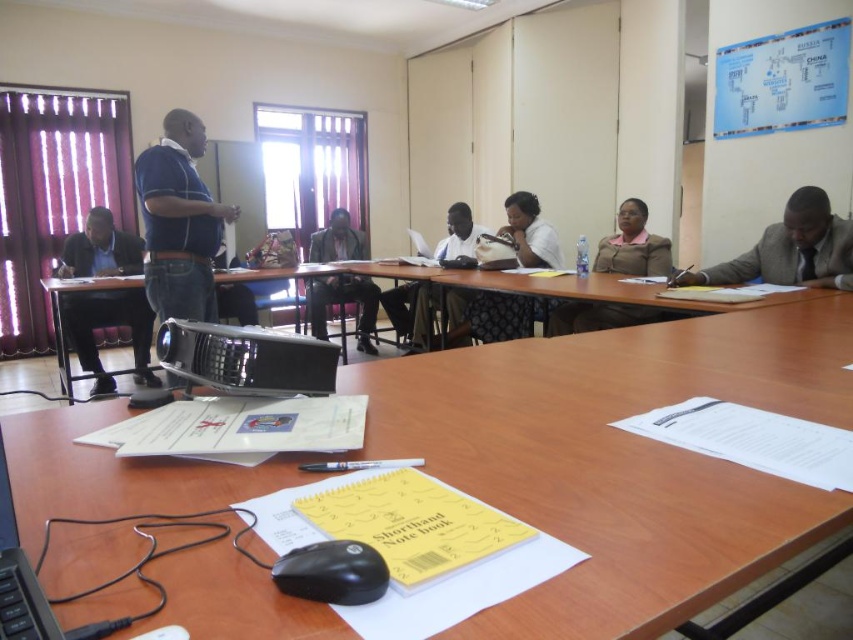
Does blue matte map at upper right appear on the right side of black plastic projector at lower left?

Yes, blue matte map at upper right is to the right of black plastic projector at lower left.

Is the position of blue matte map at upper right more distant than that of black plastic projector at lower left?

Yes.

Does point (813, 51) come farther from viewer compared to point (65, 394)?

That is False.

Where is `blue matte map at upper right`? This screenshot has height=640, width=853. blue matte map at upper right is located at coordinates (782, 81).

Is the position of brown wooden table at center less distant than that of black plastic keyboard at lower left?

No, it is behind black plastic keyboard at lower left.

Which of these two, brown wooden table at center or black plastic keyboard at lower left, stands shorter?

black plastic keyboard at lower left

Who is more distant from viewer, (473, 275) or (41, 589)?

Positioned behind is point (473, 275).

Locate an element on the screen. The width and height of the screenshot is (853, 640). brown wooden table at center is located at coordinates (556, 285).

Is blue matte map at upper right bigger than matte brown jacket at center?

No, blue matte map at upper right is not bigger than matte brown jacket at center.

Can you confirm if blue matte map at upper right is positioned below matte brown jacket at center?

No.

Locate an element on the screen. blue matte map at upper right is located at coordinates (782, 81).

At what (x,y) coordinates should I click in order to perform the action: click on blue matte map at upper right. Please return your answer as a coordinate pair (x, y). This screenshot has width=853, height=640. Looking at the image, I should click on coord(782,81).